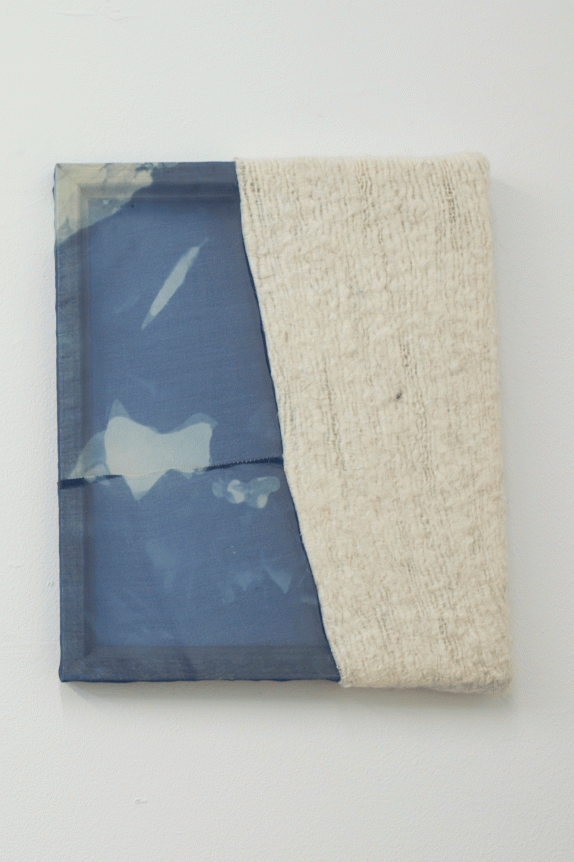
The image size is (574, 862). I want to click on internal corners, so click(x=86, y=640), click(x=80, y=186).